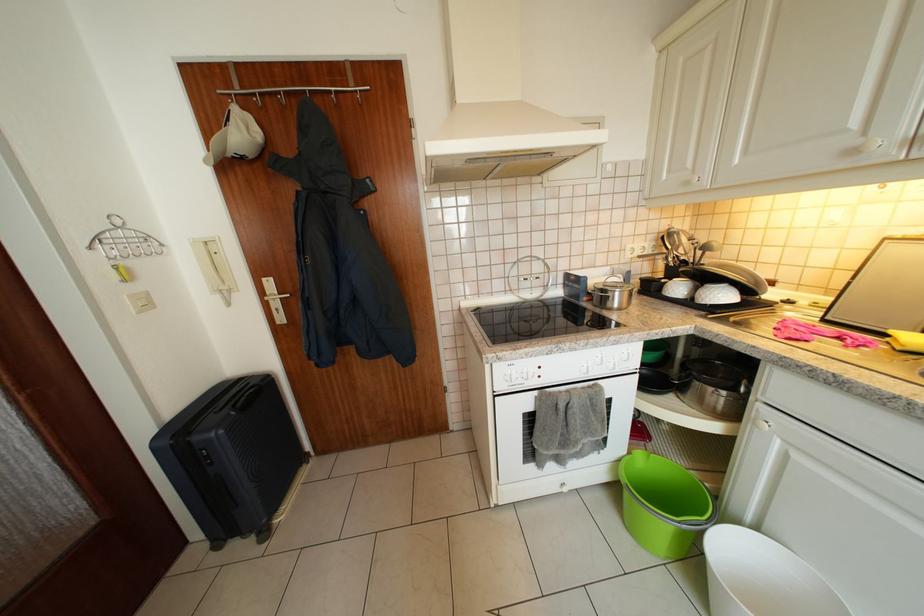
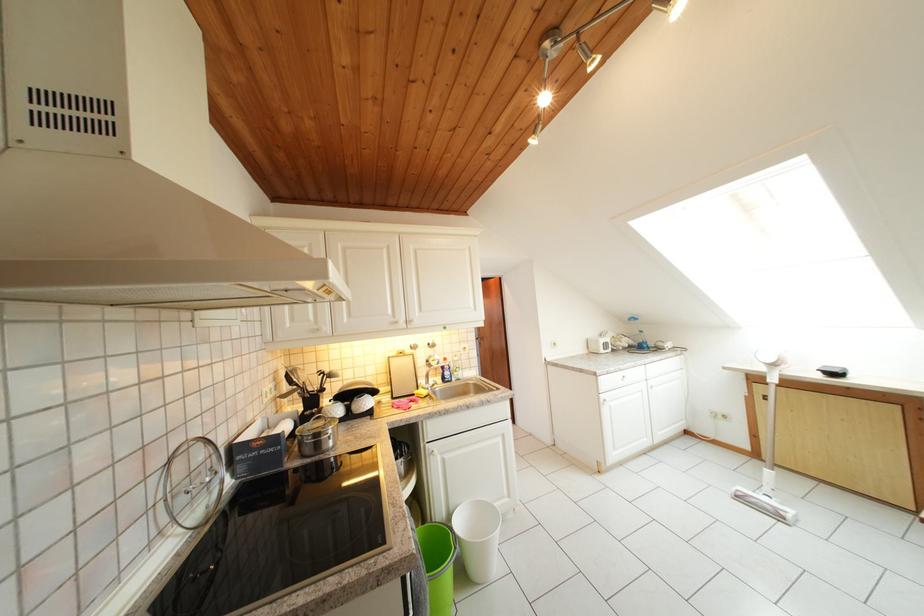
Find the pixel in the second image that matches (864,128) in the first image.

(398, 317)